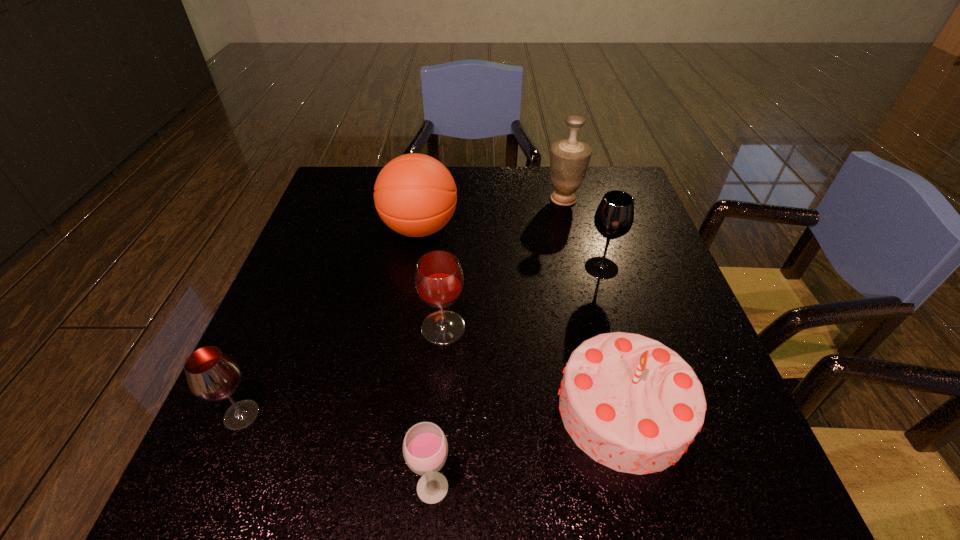
Find the location of `object that is at the left edge`. object that is at the left edge is located at coordinates tap(212, 375).

This screenshot has width=960, height=540. Find the location of `wineglass that is at the right edge`. wineglass that is at the right edge is located at coordinates (614, 217).

Where is `birthday cake present at the right edge`? birthday cake present at the right edge is located at coordinates (631, 403).

Where is `object that is at the near right corner`? The image size is (960, 540). object that is at the near right corner is located at coordinates (631, 403).

You are a GUI agent. You are given a task and a screenshot of the screen. Output one action in this format:
    pyautogui.click(x=<x>, y=<y>)
    Task: Click on the vacant space at the far edge
    The width and height of the screenshot is (960, 540).
    Given the screenshot: What is the action you would take?
    pyautogui.click(x=475, y=195)

Identify the location of vacant space at the near edge. (366, 492).

In the image, there is a desktop. Identify the location of vacant space at the left edge. (336, 289).

At what (x,y) coordinates should I click in order to perform the action: click on free space at the right edge. Please return your answer as a coordinate pair (x, y). Looking at the image, I should click on (636, 327).

Locate an element on the screen. blank area at the far left corner is located at coordinates (349, 166).

This screenshot has width=960, height=540. In order to click on vacant space at the near left corner of the desktop in this screenshot , I will do `click(246, 479)`.